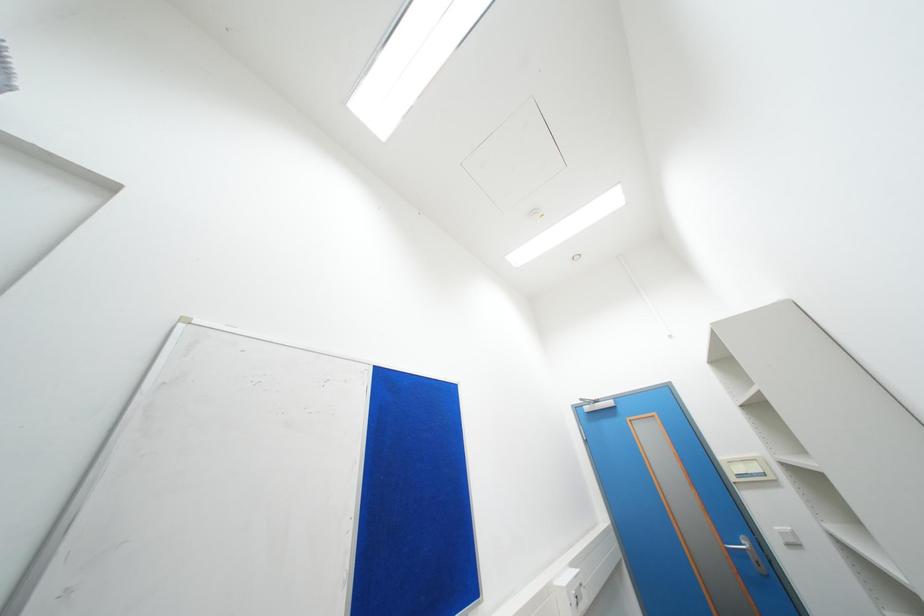
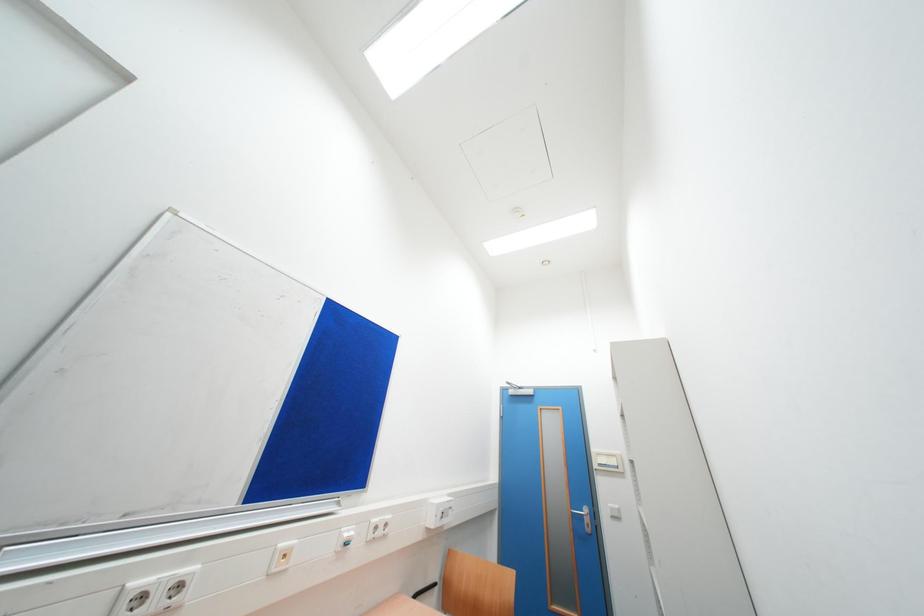
Based on the photo, the images are taken continuously from a first-person perspective. In which direction are you moving?

The movement direction of the cameraman is right, backward.